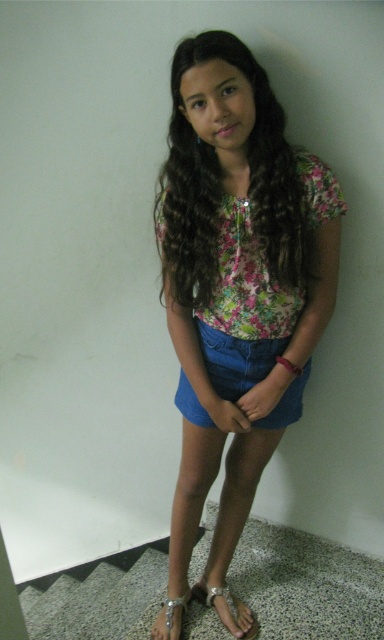
Between floral fabric blouse at center and fluffy brown hair at center, which one appears on the right side from the viewer's perspective?

floral fabric blouse at center

What do you see at coordinates (236, 282) in the screenshot? I see `floral fabric blouse at center` at bounding box center [236, 282].

The width and height of the screenshot is (384, 640). Find the location of `floral fabric blouse at center`. floral fabric blouse at center is located at coordinates (236, 282).

Who is lower down, fluffy brown hair at center or denim shorts at center?

denim shorts at center is lower down.

Can you confirm if fluffy brown hair at center is positioned above denim shorts at center?

Correct, fluffy brown hair at center is located above denim shorts at center.

Is point (188, 189) in front of point (233, 340)?

Yes, point (188, 189) is in front of point (233, 340).

The width and height of the screenshot is (384, 640). I want to click on fluffy brown hair at center, so click(x=221, y=186).

Between denim shorts at center and metallic silver sandal at lower center, which one appears on the left side from the viewer's perspective?

From the viewer's perspective, metallic silver sandal at lower center appears more on the left side.

Is point (256, 428) behind point (180, 595)?

No, it is in front of (180, 595).

Identify the location of denim shorts at center. (236, 358).